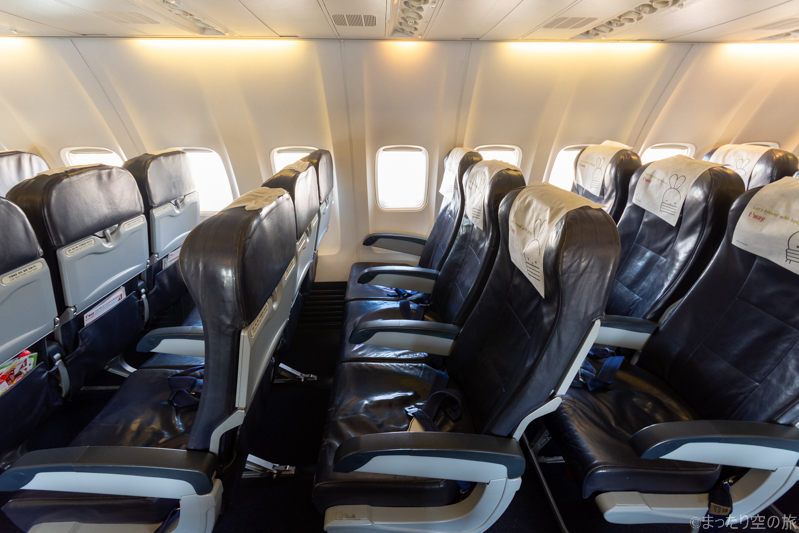
At what (x,y) coordinates should I click in order to perform the action: click on windows. Please return your answer as a coordinate pair (x, y). Looking at the image, I should click on (81, 160), (205, 169), (292, 156), (407, 171), (511, 155), (567, 163), (657, 152), (773, 144).